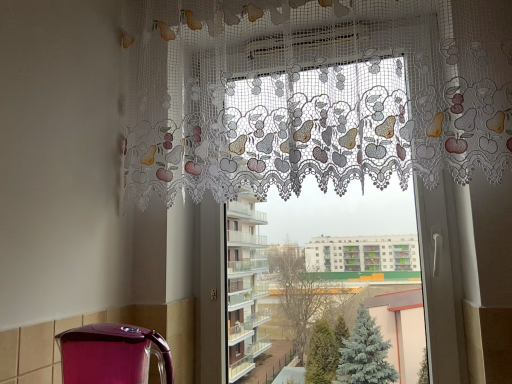
Question: Does lace fabric curtain at upper center have a larger size compared to shiny purple kettle at lower left?

Choices:
 (A) yes
 (B) no

Answer: (A)

Question: From a real-world perspective, is lace fabric curtain at upper center positioned under shiny purple kettle at lower left based on gravity?

Choices:
 (A) yes
 (B) no

Answer: (B)

Question: From the image's perspective, is lace fabric curtain at upper center over shiny purple kettle at lower left?

Choices:
 (A) no
 (B) yes

Answer: (B)

Question: Does lace fabric curtain at upper center have a lesser width compared to shiny purple kettle at lower left?

Choices:
 (A) no
 (B) yes

Answer: (B)

Question: Is lace fabric curtain at upper center completely or partially outside of shiny purple kettle at lower left?

Choices:
 (A) no
 (B) yes

Answer: (B)

Question: Is shiny purple kettle at lower left to the left or to the right of lace fabric curtain at upper center in the image?

Choices:
 (A) left
 (B) right

Answer: (A)

Question: From the image's perspective, is shiny purple kettle at lower left positioned above or below lace fabric curtain at upper center?

Choices:
 (A) above
 (B) below

Answer: (B)

Question: Choose the correct answer: Is shiny purple kettle at lower left inside lace fabric curtain at upper center or outside it?

Choices:
 (A) inside
 (B) outside

Answer: (B)

Question: Relative to lace fabric curtain at upper center, is shiny purple kettle at lower left in front or behind?

Choices:
 (A) front
 (B) behind

Answer: (A)

Question: From a real-world perspective, is lace fabric curtain at upper center physically located above or below shiny purple kettle at lower left?

Choices:
 (A) below
 (B) above

Answer: (B)

Question: Is lace fabric curtain at upper center to the left or to the right of shiny purple kettle at lower left in the image?

Choices:
 (A) left
 (B) right

Answer: (B)

Question: Is lace fabric curtain at upper center inside the boundaries of shiny purple kettle at lower left, or outside?

Choices:
 (A) inside
 (B) outside

Answer: (B)

Question: In terms of height, does lace fabric curtain at upper center look taller or shorter compared to shiny purple kettle at lower left?

Choices:
 (A) short
 (B) tall

Answer: (B)

Question: From a real-world perspective, relative to white lace curtain at upper center, is shiny purple kettle at lower left vertically above or below?

Choices:
 (A) below
 (B) above

Answer: (A)

Question: In terms of height, does shiny purple kettle at lower left look taller or shorter compared to white lace curtain at upper center?

Choices:
 (A) tall
 (B) short

Answer: (B)